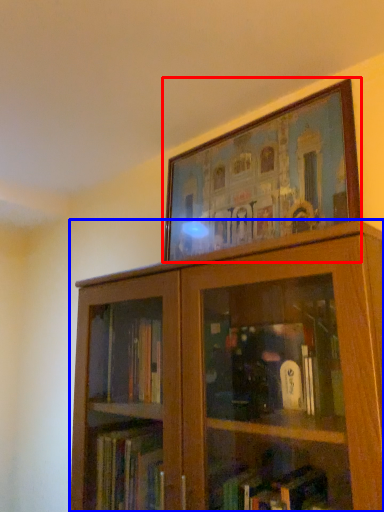
Question: Which of the following is the closest to the observer, picture frame (highlighted by a red box) or bookcase (highlighted by a blue box)?

Choices:
 (A) picture frame
 (B) bookcase

Answer: (B)